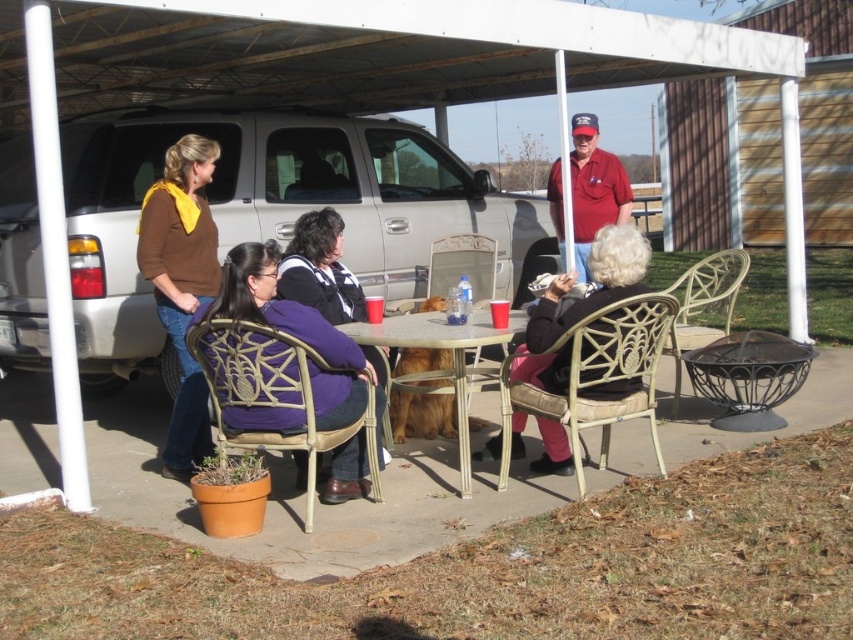
You are standing at point (314, 196) and want to walk to point (287, 356). Which direction should you move?

You should move forward because point (314, 196) is behind point (287, 356).

You are at a backyard gathering and see the silver metallic suv at center and the brown woven chair at lower left. Is the suv blocking the view of the chair?

The silver metallic suv at center is positioned over brown woven chair at lower left, so yes, the suv is blocking the view of the chair.